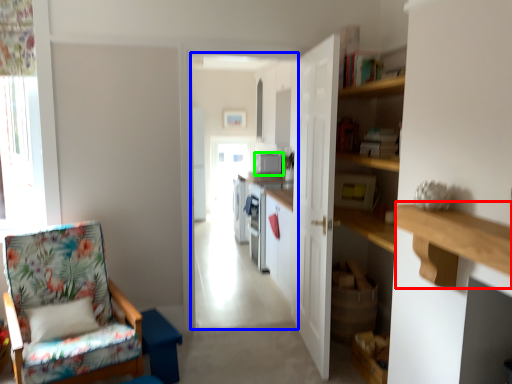
Question: Which is nearer to the ledge (highlighted by a red box)? corridor (highlighted by a blue box) or appliance (highlighted by a green box).

Choices:
 (A) corridor
 (B) appliance

Answer: (B)